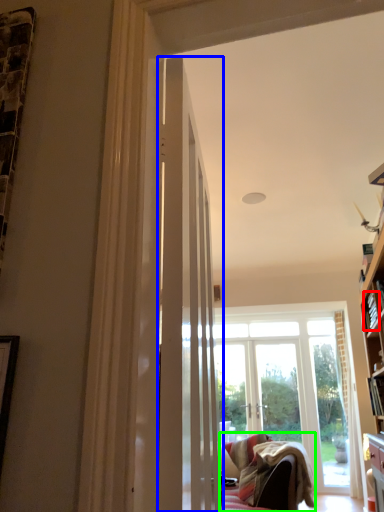
Question: Considering the real-world distances, which object is farthest from book (highlighted by a red box)? door (highlighted by a blue box) or studio couch (highlighted by a green box)?

Choices:
 (A) door
 (B) studio couch

Answer: (A)